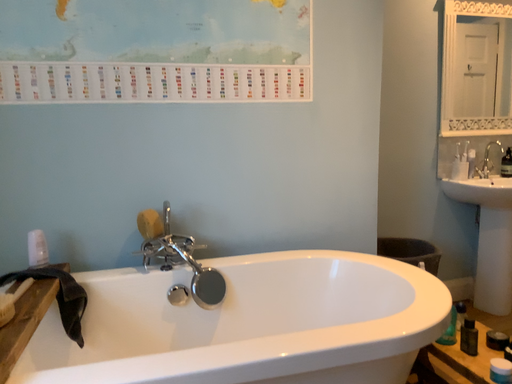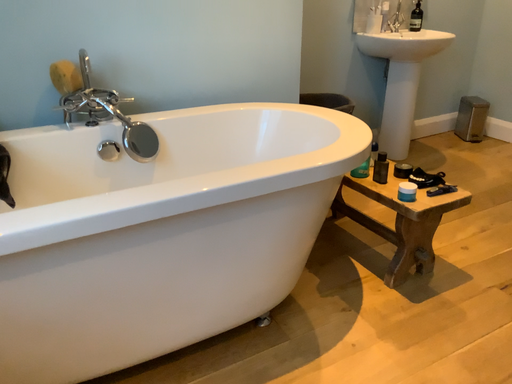
Question: How did the camera likely rotate when shooting the video?

Choices:
 (A) rotated upward
 (B) rotated downward

Answer: (B)